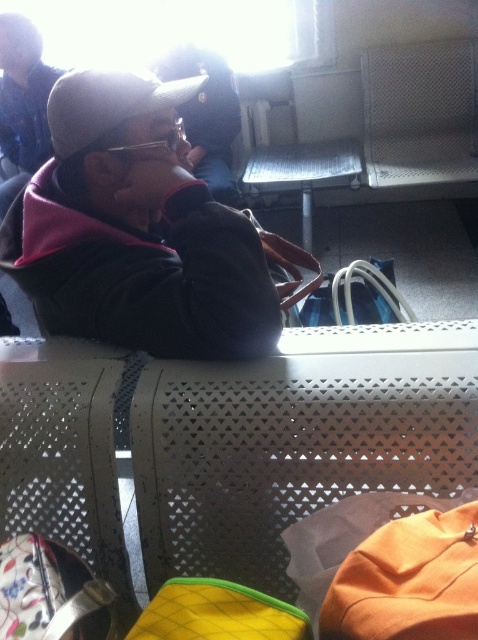
Question: Which point appears closest to the camera in this image?

Choices:
 (A) (44, 104)
 (B) (216, 326)

Answer: (B)

Question: Does matte black jacket at center have a lesser width compared to matte black cap at upper left?

Choices:
 (A) no
 (B) yes

Answer: (A)

Question: Which point is closer to the camera?

Choices:
 (A) matte black cap at upper left
 (B) matte black jacket at center

Answer: (B)

Question: Is matte black jacket at center below matte black cap at upper left?

Choices:
 (A) no
 (B) yes

Answer: (B)

Question: Which point is farther to the camera?

Choices:
 (A) (262, 349)
 (B) (0, 118)
 (C) (188, 154)

Answer: (B)

Question: Can you confirm if matte black jacket at center is positioned to the left of matte black jacket at upper center?

Choices:
 (A) no
 (B) yes

Answer: (B)